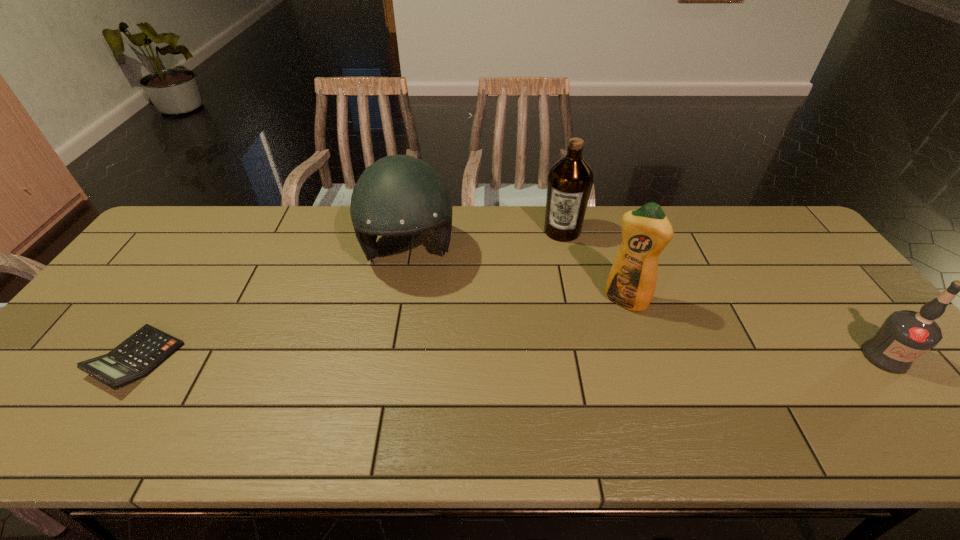
The width and height of the screenshot is (960, 540). I want to click on free space located on the label of the detergent, so click(x=568, y=390).

At what (x,y) coordinates should I click in order to perform the action: click on vacant space situated 0.120m on the label of the olive oil. Please return your answer as a coordinate pair (x, y). This screenshot has height=540, width=960. Looking at the image, I should click on (551, 268).

The width and height of the screenshot is (960, 540). I want to click on free spot located on the label of the olive oil, so click(x=542, y=296).

At what (x,y) coordinates should I click in order to perform the action: click on free space located 0.050m on the label of the olive oil. Please return your answer as a coordinate pair (x, y). Looking at the image, I should click on (556, 253).

Locate an element on the screen. free space located 0.270m at the face opening of the second object from left to right is located at coordinates (418, 366).

This screenshot has width=960, height=540. Identify the location of free region located at the face opening of the second object from left to right. (416, 343).

Where is `vacant space located 0.100m at the face opening of the second object from left to right`? The image size is (960, 540). vacant space located 0.100m at the face opening of the second object from left to right is located at coordinates (413, 314).

In order to click on olive oil that is positioned at the far edge in this screenshot , I will do `click(570, 180)`.

Identify the location of football helmet located at the far edge. (398, 195).

At what (x,y) coordinates should I click in order to perform the action: click on calculator that is at the near edge. Please return your answer as a coordinate pair (x, y). The image size is (960, 540). Looking at the image, I should click on (136, 357).